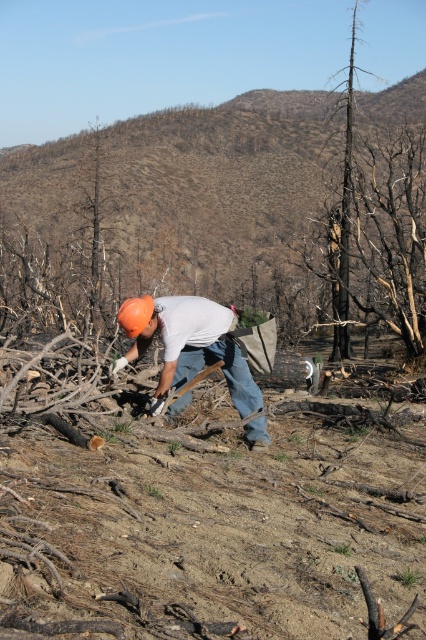
You are a firefighter assessing the area after a wildfire. You notice two objects in the scene described as burnt wood at center and burnt wood tree at upper right. Based on their positions, which one is closer to the ground?

The burnt wood at center is closer to the ground because it is positioned below the burnt wood tree at upper right.

You are a safety inspector assessing the scene. You notice the burnt wood tree at upper right and the orange matte helmet at center. Based on their positions, which object is higher from the ground?

The burnt wood tree at upper right is above the orange matte helmet at center, so it is higher from the ground.